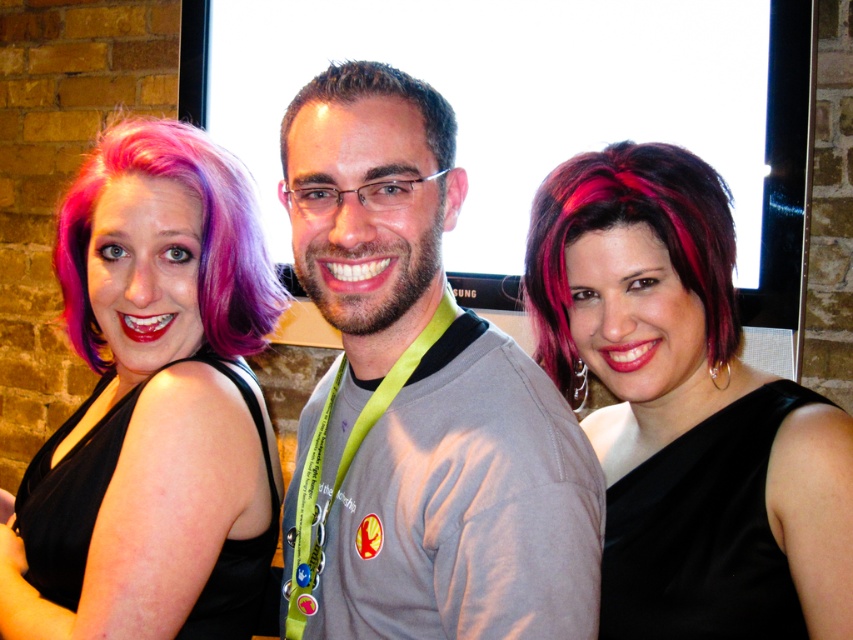
The image size is (853, 640). Find the location of `gray fabric shirt at center`. gray fabric shirt at center is located at coordinates pos(418,400).

Which is more to the left, gray fabric shirt at center or shiny black dress at center?

Positioned to the left is gray fabric shirt at center.

What do you see at coordinates (418, 400) in the screenshot?
I see `gray fabric shirt at center` at bounding box center [418, 400].

I want to click on gray fabric shirt at center, so click(x=418, y=400).

Is matte purple wig at left below brown matte hair at center?

Correct, matte purple wig at left is located below brown matte hair at center.

Between matte purple wig at left and brown matte hair at center, which one has less height?

With less height is brown matte hair at center.

Does point (80, 605) lie in front of point (311, 81)?

No.

The height and width of the screenshot is (640, 853). I want to click on matte purple wig at left, so click(x=154, y=401).

Does purplehair at left have a lesser width compared to brown matte hair at center?

In fact, purplehair at left might be wider than brown matte hair at center.

Can you confirm if purplehair at left is smaller than brown matte hair at center?

Actually, purplehair at left might be larger than brown matte hair at center.

Locate an element on the screen. purplehair at left is located at coordinates (200, 241).

Where is `purplehair at left`? This screenshot has width=853, height=640. purplehair at left is located at coordinates (200, 241).